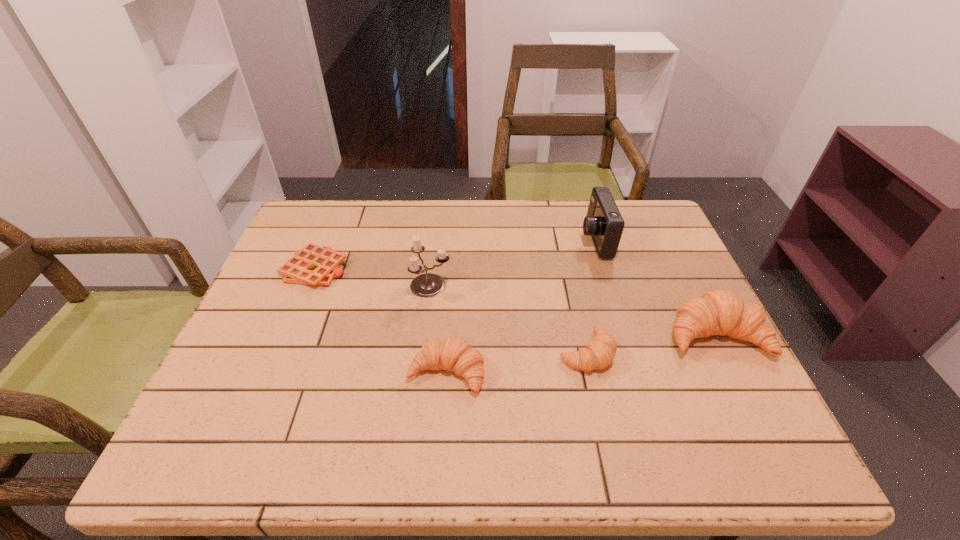
At what (x,y) coordinates should I click in order to perform the action: click on crescent roll that is the second closest one to the candle holder. Please return your answer as a coordinate pair (x, y). This screenshot has width=960, height=540. Looking at the image, I should click on (599, 353).

What are the coordinates of `crescent roll identified as the closest to the leftmost object` in the screenshot? It's located at (455, 354).

The height and width of the screenshot is (540, 960). What are the coordinates of `free space that satisfies the following two spatial constraints: 1. on the front-facing side of the camera; 2. on the back side of the fourth shortest object` in the screenshot? It's located at (623, 334).

Find the location of a particular element. vacant point that satisfies the following two spatial constraints: 1. on the front-facing side of the rightmost crescent roll; 2. on the left side of the camera is located at coordinates (623, 334).

What are the coordinates of `free location that satisfies the following two spatial constraints: 1. on the front side of the leftmost crescent roll; 2. on the right side of the candle holder` in the screenshot? It's located at (420, 372).

Where is `vacant area in the image that satisfies the following two spatial constraints: 1. on the front-facing side of the camera; 2. on the back side of the rightmost object`? The height and width of the screenshot is (540, 960). vacant area in the image that satisfies the following two spatial constraints: 1. on the front-facing side of the camera; 2. on the back side of the rightmost object is located at coordinates (623, 334).

You are a GUI agent. You are given a task and a screenshot of the screen. Output one action in this format:
    pyautogui.click(x=<x>, y=<y>)
    Task: Click on the vacant region that satisfies the following two spatial constraints: 1. on the front-facing side of the camera; 2. on the front side of the shortest crescent roll
    This screenshot has height=540, width=960.
    Given the screenshot: What is the action you would take?
    pyautogui.click(x=629, y=353)

Identify the location of free space in the image that satisfies the following two spatial constraints: 1. on the front-facing side of the camera; 2. on the front side of the leftmost crescent roll. Image resolution: width=960 pixels, height=540 pixels. (635, 372).